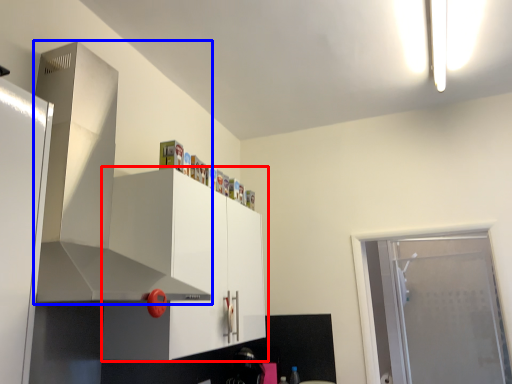
Question: Which of the following is the farthest to the observer, cabinetry (highlighted by a red box) or exhaust hood (highlighted by a blue box)?

Choices:
 (A) cabinetry
 (B) exhaust hood

Answer: (A)